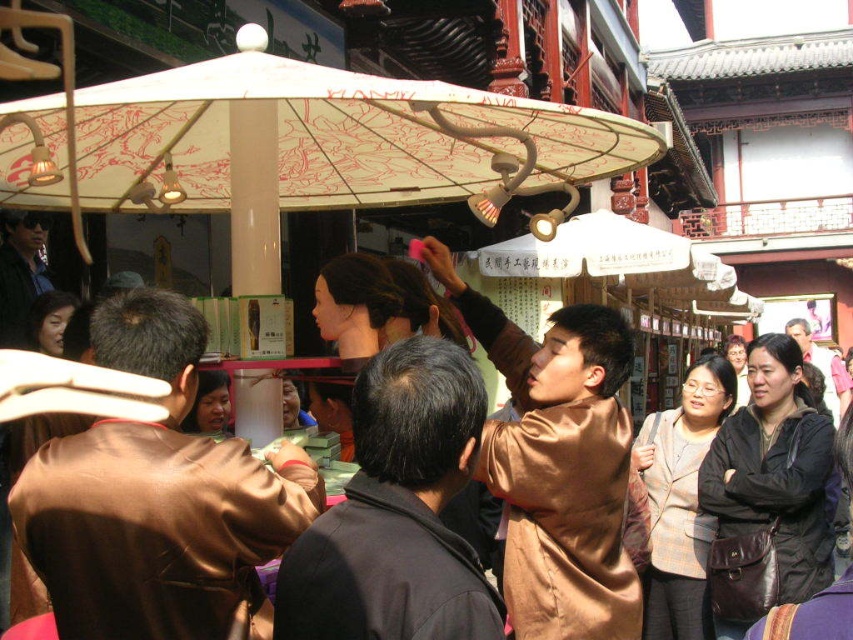
You are a visitor at this market and want to take a photo of both the black matte robe at center and the brown satin robe at lower right. Which robe should you focus on first if you want to capture both in the same frame without moving your camera?

You should focus on the black matte robe at center first because it is above the brown satin robe at lower right, so adjusting the camera angle to include both would require framing from the higher position downward.

You are standing in the market and want to buy a souvenir. You see the white paper umbrella at upper center. Where exactly is it located in the image?

The white paper umbrella at upper center is located at point (300, 147).